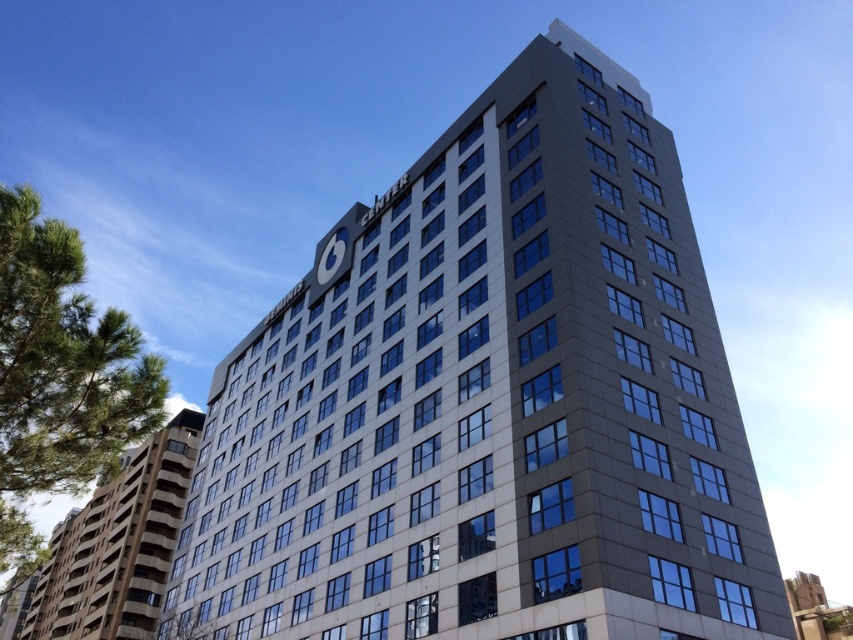
You are standing in front of the building and want to locate two specific points marked on the building facade. The first point is at coordinate point (529, 54) and the second is at point (175, 465). Which of these points is closer to you?

Point (529, 54) is closer to the viewer than point (175, 465).

You are standing at the point marked by the coordinates point (489, 403) in the scene. What structure are you facing?

The point (489, 403) marks the slate gray building at center, so you are facing the slate gray building at center.

You are a delivery drone with a wingspan of 10 feet. You need to fly between the slate gray building at center and the gray concrete building at lower left. Can you safely navigate the space between them without hitting either building?

The distance between the slate gray building at center and the gray concrete building at lower left is 102.47 feet. Since your wingspan is only 10 feet, there is more than enough space to safely navigate between them without any collision risk.